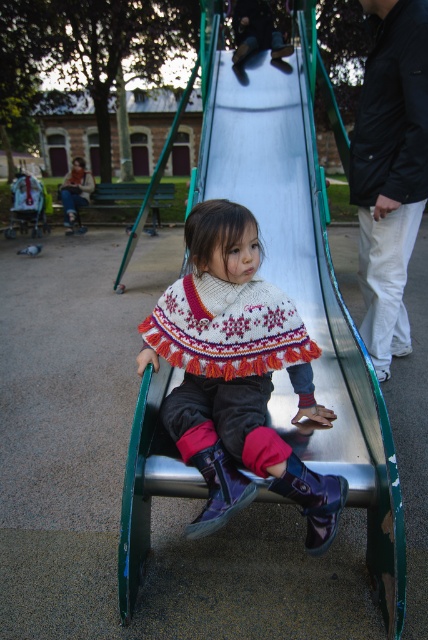
You are a photographer trying to capture the metallic silver slide at center and the knitted wool poncho at center in a single shot. Since you want the slide to be the main focus, which object should you adjust your camera to prioritize in terms of depth of field?

The metallic silver slide at center is closer to the viewer than the knitted wool poncho at center, so you should adjust your camera to prioritize the metallic silver slide at center for the depth of field to ensure it remains sharp and in focus.

You are a parent standing at the edge of the playground. You see your child wearing a knitted wool poncho at center and a metallic silver slide at center. The slide is 4.97 feet away from the poncho. If you want to reach your child quickly, which object should you approach first?

Since the metallic silver slide at center and the knitted wool poncho at center are both at the same central position, you can approach either one to reach your child quickly. However, the slide is 4.97 feet away from the poncho, so you should check the exact location based on their positions.